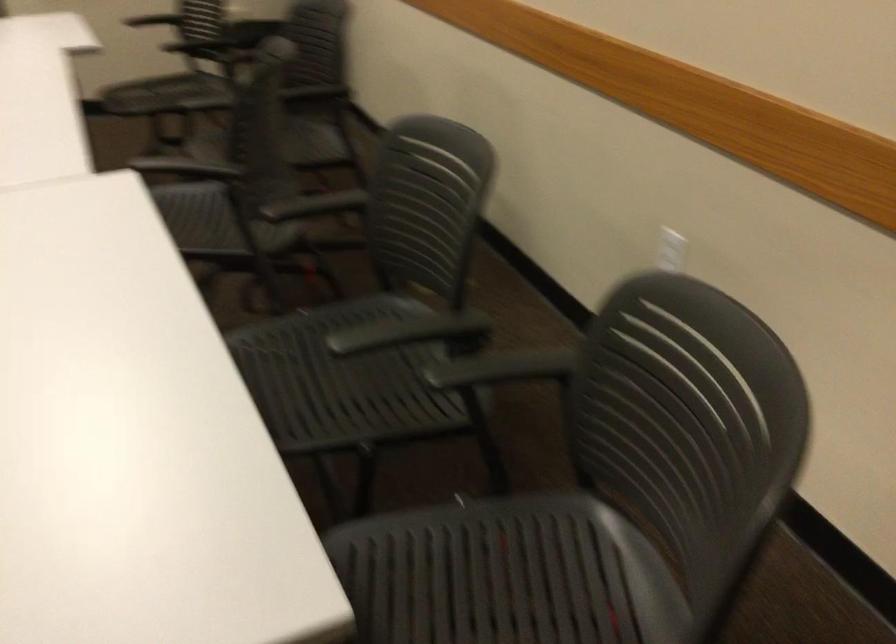
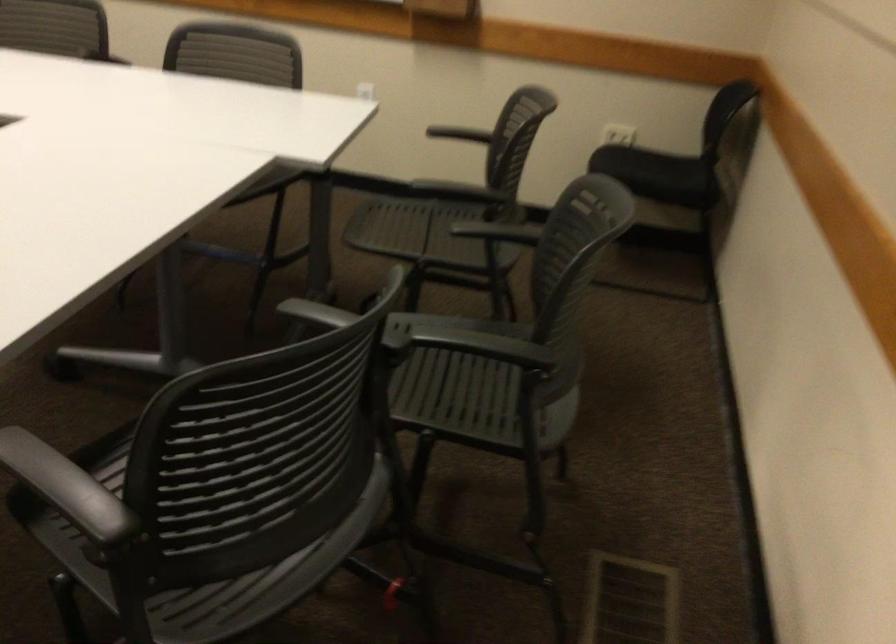
Find the pixel in the second image that matches pixel 328 97 in the first image.

(504, 359)